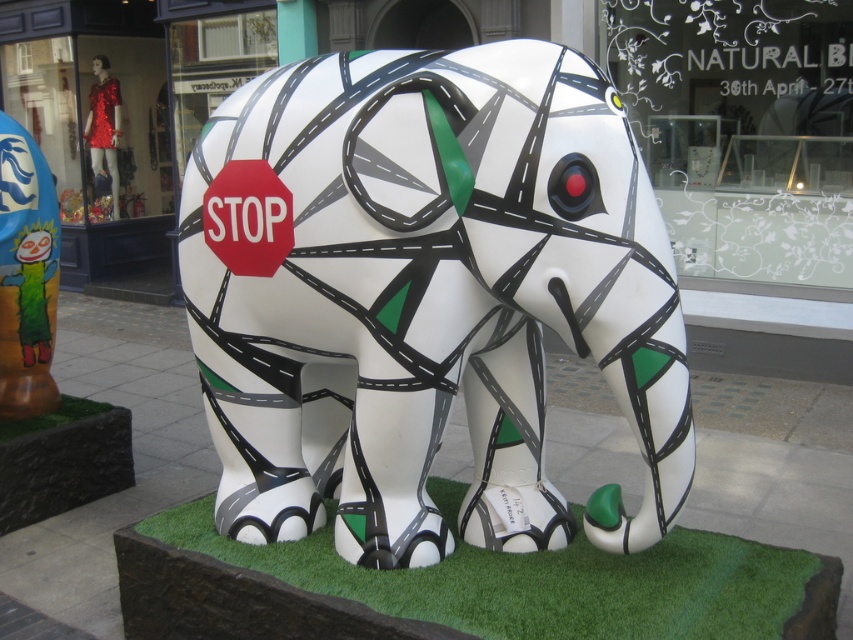
Does matte orange cactus at left appear under green artificial turf at lower left?

Incorrect, matte orange cactus at left is not positioned below green artificial turf at lower left.

Describe the element at coordinates (26, 275) in the screenshot. The height and width of the screenshot is (640, 853). I see `matte orange cactus at left` at that location.

The height and width of the screenshot is (640, 853). Describe the element at coordinates (26, 275) in the screenshot. I see `matte orange cactus at left` at that location.

The image size is (853, 640). I want to click on matte orange cactus at left, so click(x=26, y=275).

Is white glossy elephant at center behind green artificial turf at lower left?

That is False.

Who is lower down, white glossy elephant at center or green artificial turf at lower left?

green artificial turf at lower left

The width and height of the screenshot is (853, 640). I want to click on white glossy elephant at center, so click(x=434, y=300).

I want to click on white glossy elephant at center, so click(x=434, y=300).

Is green artificial turf at lower center smaller than green artificial turf at lower left?

No.

Locate an element on the screen. This screenshot has width=853, height=640. green artificial turf at lower center is located at coordinates (541, 582).